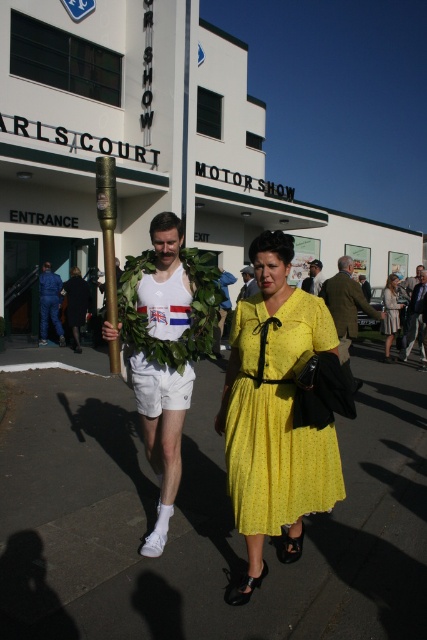
You are standing at the entrance of CARLS COURT MOTOR SHOW and need to reach the exit. There are two objects in your path at the center of the image, a white fabric shorts at center and a matte white tank top at center. Which object is closer to you? Please answer based on their distance apart.

The white fabric shorts at center and matte white tank top at center are 8.04 meters apart. Since the question asks which is closer but the description only provides the distance between them, not their individual distances from you, I cannot determine which is closer without additional information.

You are standing in front of CARLS COURT MOTOR SHOW and see two people walking. The man is wearing a matte white tank top at center and white fabric shorts at center. Which clothing item is positioned more to the left?

The white fabric shorts at center are to the left of the matte white tank top at center, so the white fabric shorts at center is positioned more to the left.

You are a visitor at CARLS COURT MOTOR SHOW and need to carry both the gold metallic pole at center and the matte gold torch at center to the registration desk. The desk is 10 meters away from your current position. Can you carry both items to the desk without dropping them if you place them end to end in a straight line?

The gold metallic pole at center and matte gold torch at center are 9.71 meters apart from each other. Since the desk is 10 meters away, placing them end to end in a straight line would allow you to carry both items to the desk without dropping them as the combined length is within the required distance.